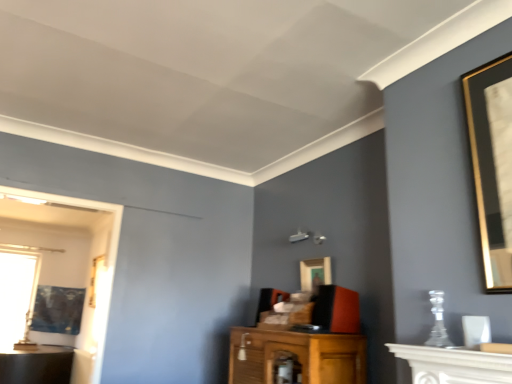
Question: In terms of size, does gold-framed picture at left, which ranks as the second picture frame in back-to-front order, appear bigger or smaller than gold-framed picture at center, the 1th picture frame in the right-to-left sequence?

Choices:
 (A) small
 (B) big

Answer: (B)

Question: In terms of height, does gold-framed picture at left, which appears as the 2th picture frame when ordered from the bottom, look taller or shorter compared to gold-framed picture at center, arranged as the 1th picture frame when viewed from the top?

Choices:
 (A) short
 (B) tall

Answer: (B)

Question: Considering the real-world distances, which object is farthest from the transparent glass window at left?

Choices:
 (A) white marble fireplace at lower right
 (B) gold-framed picture at center, the 1th picture frame in the right-to-left sequence
 (C) matte black picture frame at left, the 1th picture frame viewed from the left
 (D) gold-framed picture at left, the second picture frame positioned from the left

Answer: (A)

Question: Based on their relative distances, which object is farther from the gold-framed picture at left, the second picture frame from the top?

Choices:
 (A) transparent glass window at left
 (B) white marble fireplace at lower right
 (C) matte black picture frame at left, the third picture frame viewed from the front
 (D) gold-framed picture at center, positioned as the 3th picture frame in left-to-right order

Answer: (A)